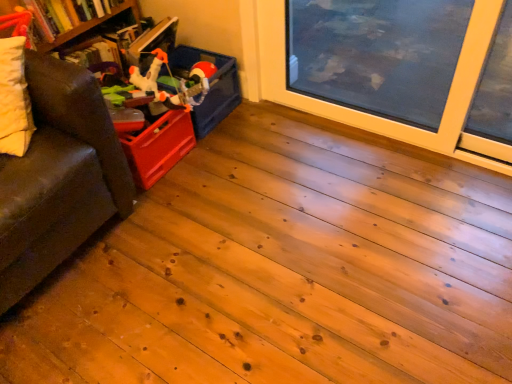
Question: Is matte plastic storage box at upper left positioned with its back to hardcover book at upper left?

Choices:
 (A) no
 (B) yes

Answer: (A)

Question: From the image's perspective, is matte plastic storage box at upper left located above hardcover book at upper left?

Choices:
 (A) no
 (B) yes

Answer: (A)

Question: Is matte plastic storage box at upper left smaller than hardcover book at upper left?

Choices:
 (A) no
 (B) yes

Answer: (B)

Question: Considering the relative positions of matte plastic storage box at upper left and hardcover book at upper left in the image provided, is matte plastic storage box at upper left to the right of hardcover book at upper left from the viewer's perspective?

Choices:
 (A) no
 (B) yes

Answer: (B)

Question: Does matte plastic storage box at upper left lie behind hardcover book at upper left?

Choices:
 (A) yes
 (B) no

Answer: (A)

Question: Does matte plastic storage box at upper left lie in front of hardcover book at upper left?

Choices:
 (A) no
 (B) yes

Answer: (A)

Question: Is matte plastic toy at upper left outside of brown leather couch at left?

Choices:
 (A) yes
 (B) no

Answer: (A)

Question: Does matte plastic toy at upper left have a lesser width compared to brown leather couch at left?

Choices:
 (A) yes
 (B) no

Answer: (A)

Question: Considering the relative sizes of matte plastic toy at upper left and brown leather couch at left in the image provided, is matte plastic toy at upper left bigger than brown leather couch at left?

Choices:
 (A) no
 (B) yes

Answer: (A)

Question: Is matte plastic toy at upper left positioned in front of brown leather couch at left?

Choices:
 (A) no
 (B) yes

Answer: (A)

Question: Is matte plastic toy at upper left smaller than brown leather couch at left?

Choices:
 (A) no
 (B) yes

Answer: (B)

Question: Does matte plastic toy at upper left turn towards brown leather couch at left?

Choices:
 (A) yes
 (B) no

Answer: (B)

Question: Can you confirm if matte plastic toy at upper left is positioned to the right of matte plastic storage box at upper left?

Choices:
 (A) no
 (B) yes

Answer: (A)